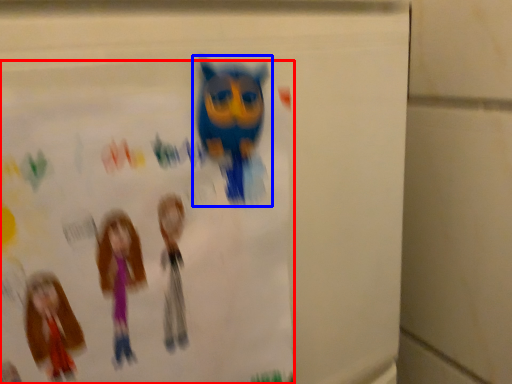
Question: Which object is closer to the camera taking this photo, poster (highlighted by a red box) or toy (highlighted by a blue box)?

Choices:
 (A) poster
 (B) toy

Answer: (A)